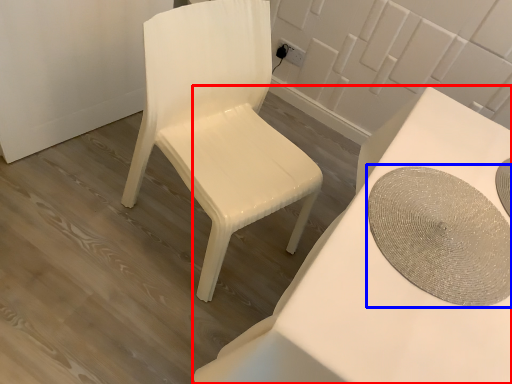
Question: Which of the following is the closest to the observer, table (highlighted by a red box) or round table (highlighted by a blue box)?

Choices:
 (A) table
 (B) round table

Answer: (A)